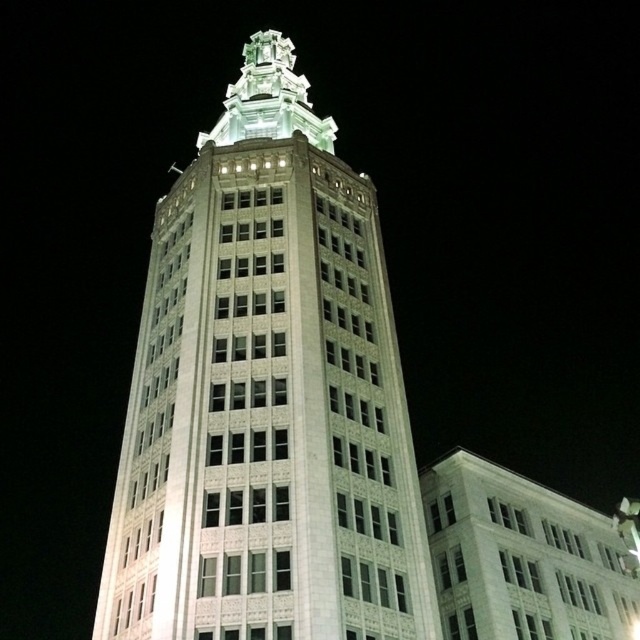
Is white stone tower at center thinner than white glossy spire at upper center?

In fact, white stone tower at center might be wider than white glossy spire at upper center.

Who is more distant from viewer, (x=173, y=298) or (x=273, y=38)?

The point (x=273, y=38) is more distant.

The width and height of the screenshot is (640, 640). Describe the element at coordinates (266, 397) in the screenshot. I see `white stone tower at center` at that location.

Identify the location of white stone tower at center. The width and height of the screenshot is (640, 640). (266, 397).